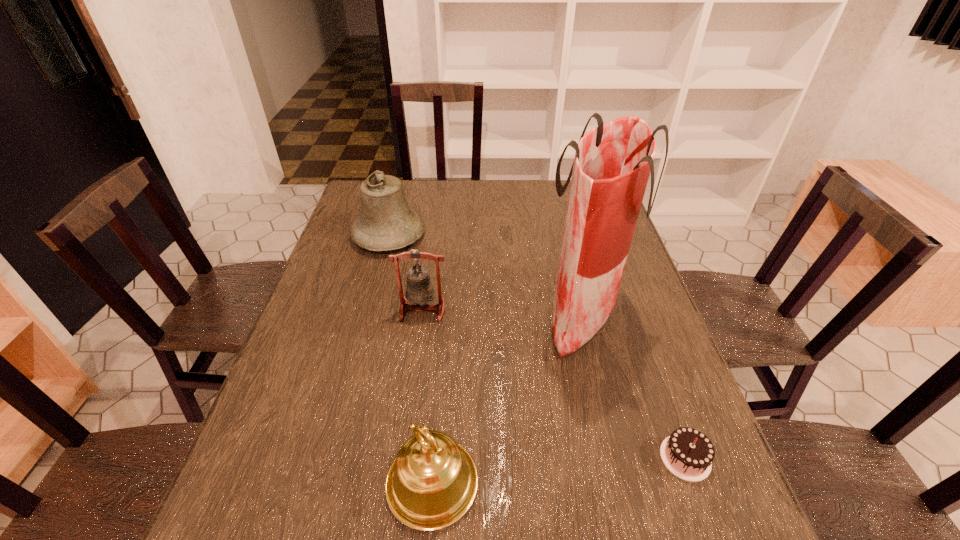
Find the location of `object at the near edge`. object at the near edge is located at coordinates (x=431, y=484).

Where is `object present at the left edge`? The width and height of the screenshot is (960, 540). object present at the left edge is located at coordinates (386, 222).

At what (x,y) coordinates should I click in order to perform the action: click on grocery bag at the right edge. Please return your answer as a coordinate pair (x, y). Looking at the image, I should click on (612, 163).

At what (x,y) coordinates should I click in order to perform the action: click on chocolate cake that is at the right edge. Please return your answer as a coordinate pair (x, y). Looking at the image, I should click on (687, 453).

You are a GUI agent. You are given a task and a screenshot of the screen. Output one action in this format:
    pyautogui.click(x=<x>, y=<y>)
    Task: Click on the vacant space at the far edge of the desktop
    This screenshot has width=960, height=540.
    Given the screenshot: What is the action you would take?
    pyautogui.click(x=492, y=187)

Locate an element on the screen. The height and width of the screenshot is (540, 960). free space at the left edge is located at coordinates (344, 232).

Image resolution: width=960 pixels, height=540 pixels. What are the coordinates of `free space at the right edge of the desktop` in the screenshot? It's located at (667, 426).

This screenshot has height=540, width=960. I want to click on free space between the grocery bag and the nearest bell, so click(x=507, y=400).

At what (x,y) coordinates should I click in order to perform the action: click on free point between the second farthest bell and the farthest bell. Please return your answer as a coordinate pair (x, y). The width and height of the screenshot is (960, 540). Looking at the image, I should click on (406, 273).

At what (x,y) coordinates should I click in order to perform the action: click on unoccupied area between the second farthest bell and the shortest object. Please return your answer as a coordinate pair (x, y). Image resolution: width=960 pixels, height=540 pixels. Looking at the image, I should click on (554, 384).